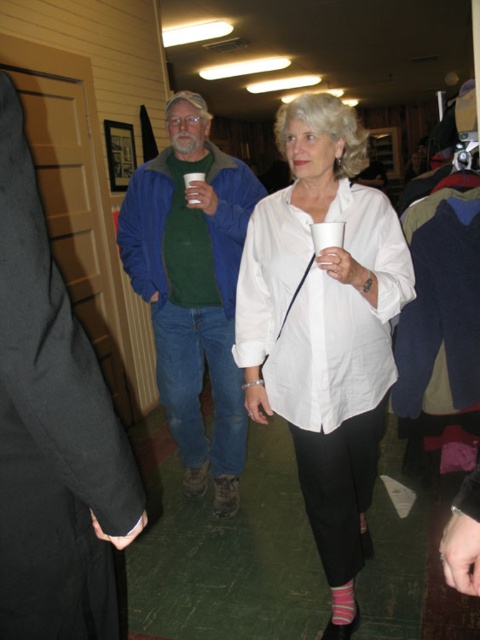
Who is shorter, white matte shirt at center or white paper cup at center?

white paper cup at center

Between white matte shirt at center and white paper cup at center, which one appears on the left side from the viewer's perspective?

Positioned to the left is white paper cup at center.

Where is `white matte shirt at center`? white matte shirt at center is located at coordinates (324, 321).

Is matte blue jacket at center above pink striped sock at lower center?

Correct, matte blue jacket at center is located above pink striped sock at lower center.

Is matte blue jacket at center to the left of pink striped sock at lower center from the viewer's perspective?

Correct, you'll find matte blue jacket at center to the left of pink striped sock at lower center.

Find the location of a particular element. The image size is (480, 640). matte blue jacket at center is located at coordinates (52, 429).

From the picture: Is pink striped sock at lower center closer to the viewer compared to white paper cup at center?

Yes, it is in front of white paper cup at center.

Can you confirm if pink striped sock at lower center is taller than white paper cup at center?

No, pink striped sock at lower center is not taller than white paper cup at center.

Who is more distant from viewer, (348, 621) or (193, 179)?

Point (193, 179)

Locate an element on the screen. This screenshot has height=640, width=480. pink striped sock at lower center is located at coordinates (343, 604).